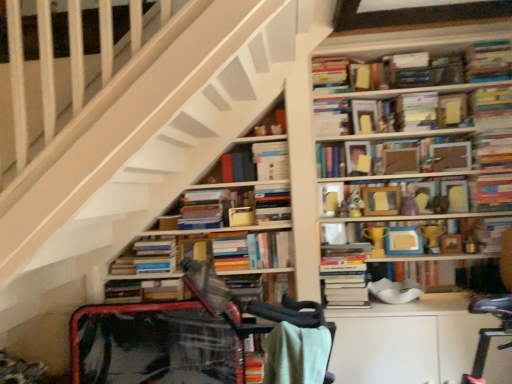
Identify the location of empty space that is ontop of hardcover books at lower left, which appears as the 4th book when ordered from the bottom (from a real-world perspective). (139, 240).